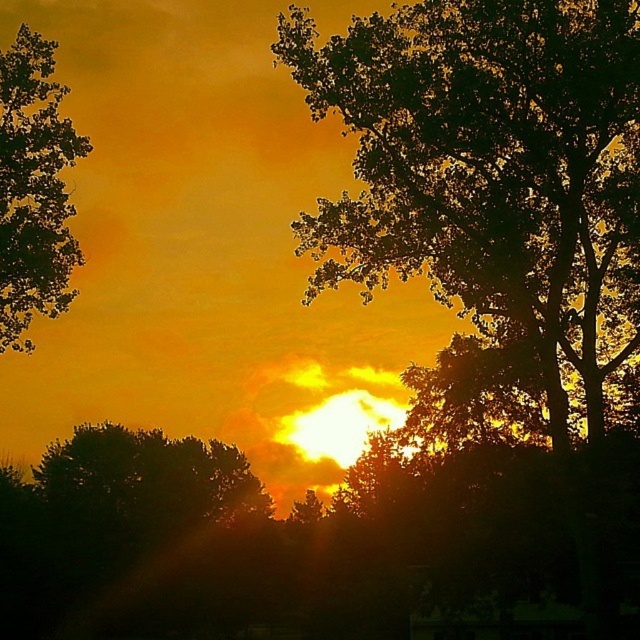
Image resolution: width=640 pixels, height=640 pixels. What do you see at coordinates (468, 148) in the screenshot? I see `dark green leafy tree at center` at bounding box center [468, 148].

Is point (465, 294) positioned behind point (54, 113)?

That is False.

Identify the location of dark green leafy tree at center. This screenshot has width=640, height=640. (468, 148).